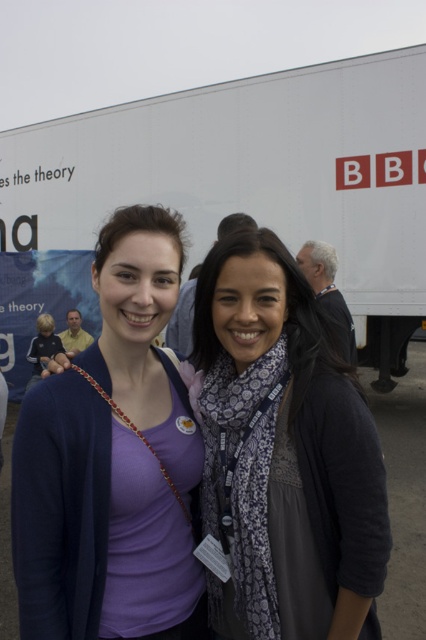
Is white matte trailer truck at upper center wider than matte purple shirt at center?

No, white matte trailer truck at upper center is not wider than matte purple shirt at center.

Is white matte trailer truck at upper center taller than matte purple shirt at center?

Incorrect, white matte trailer truck at upper center's height is not larger of matte purple shirt at center's.

This screenshot has width=426, height=640. What do you see at coordinates (247, 170) in the screenshot?
I see `white matte trailer truck at upper center` at bounding box center [247, 170].

Where is `white matte trailer truck at upper center`? Image resolution: width=426 pixels, height=640 pixels. white matte trailer truck at upper center is located at coordinates (247, 170).

Between matte purple shirt at center and patterned scarf at center, which one appears on the left side from the viewer's perspective?

matte purple shirt at center

Where is `matte purple shirt at center`? The height and width of the screenshot is (640, 426). matte purple shirt at center is located at coordinates (95, 525).

Which of these two, white matte trailer truck at upper center or patterned scarf at center, stands shorter?

white matte trailer truck at upper center is shorter.

Is white matte trailer truck at upper center wider than patterned scarf at center?

In fact, white matte trailer truck at upper center might be narrower than patterned scarf at center.

Does point (273, 204) come farther from viewer compared to point (273, 620)?

Yes, point (273, 204) is behind point (273, 620).

I want to click on white matte trailer truck at upper center, so click(247, 170).